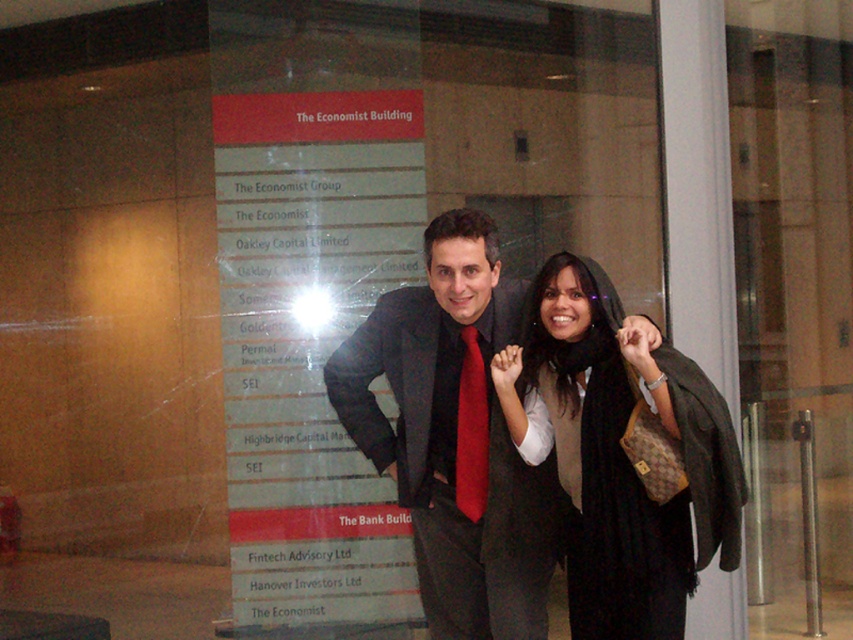
From the picture: You are standing in front of the glass wall with the signboard and notice the black fabric scarf at center. Can you determine its exact position using the coordinate system provided?

The black fabric scarf at center is located at point (619, 452).

You are standing in front of the glass wall with the signboard. You want to take a photo of the matte black suit at center without the metallic signboard at center overlapping in the frame. Is it possible to do so by moving sideways to the right?

The metallic signboard at center might be wider than matte black suit at center, so moving sideways to the right may not ensure that the metallic signboard at center wonot overlap with the matte black suit at center in the photo.